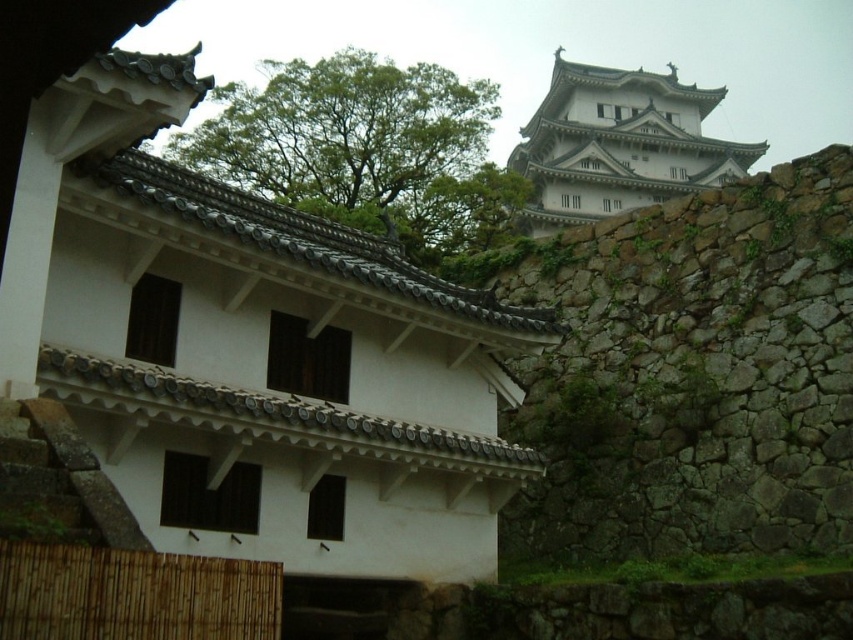
Question: Among these points, which one is farthest from the camera?

Choices:
 (A) (207, 524)
 (B) (543, 216)

Answer: (B)

Question: In this image, where is white tile roof at center located relative to white stone tower at upper center?

Choices:
 (A) above
 (B) below

Answer: (B)

Question: Does white tile roof at center have a larger size compared to white stone tower at upper center?

Choices:
 (A) no
 (B) yes

Answer: (A)

Question: Can you confirm if white tile roof at center is positioned below white stone tower at upper center?

Choices:
 (A) yes
 (B) no

Answer: (A)